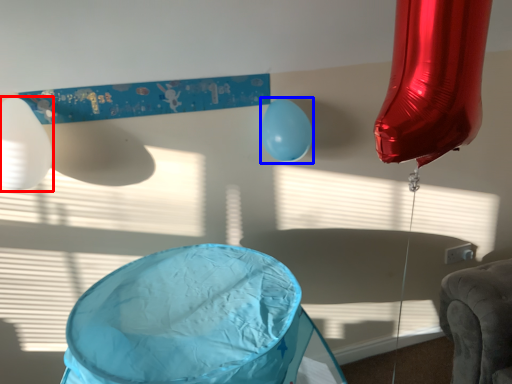
Question: Which point is further to the camera, balloon (highlighted by a red box) or balloon (highlighted by a blue box)?

Choices:
 (A) balloon
 (B) balloon

Answer: (B)